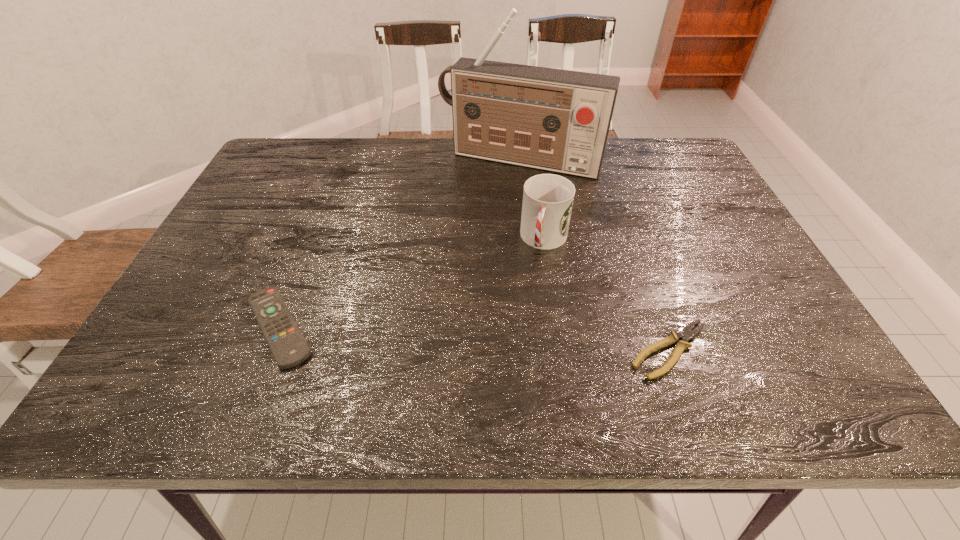
The image size is (960, 540). I want to click on the leftmost object, so click(x=289, y=348).

Where is `remote control`? The height and width of the screenshot is (540, 960). remote control is located at coordinates (289, 348).

This screenshot has height=540, width=960. What are the coordinates of `pliers` in the screenshot? It's located at (686, 333).

The width and height of the screenshot is (960, 540). Find the location of `the third shortest object`. the third shortest object is located at coordinates (548, 199).

The height and width of the screenshot is (540, 960). Find the location of `cup`. cup is located at coordinates (548, 199).

Where is `the farthest object`? The image size is (960, 540). the farthest object is located at coordinates (557, 120).

I want to click on the tallest object, so click(557, 120).

This screenshot has width=960, height=540. Identify the location of vacant space located 0.090m on the left of the remote control. (194, 327).

At what (x,y) coordinates should I click in order to perform the action: click on vacant region located 0.140m on the back of the pliers. Please return your answer as a coordinate pair (x, y). The height and width of the screenshot is (540, 960). Looking at the image, I should click on (643, 273).

What are the coordinates of `vacant space positioned on the side of the second farthest object where the handle is located` in the screenshot? It's located at (520, 329).